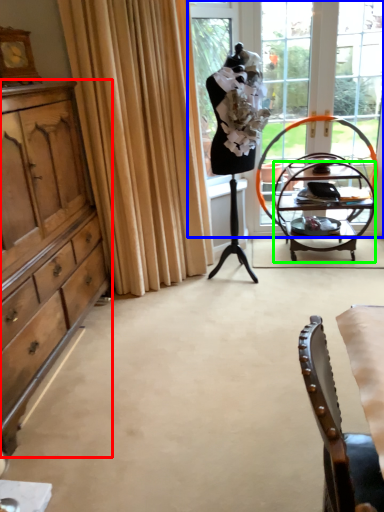
Question: Based on their relative distances, which object is nearer to cabinetry (highlighted by a red box)? Choose from window (highlighted by a blue box) and desk (highlighted by a green box).

Choices:
 (A) window
 (B) desk

Answer: (A)